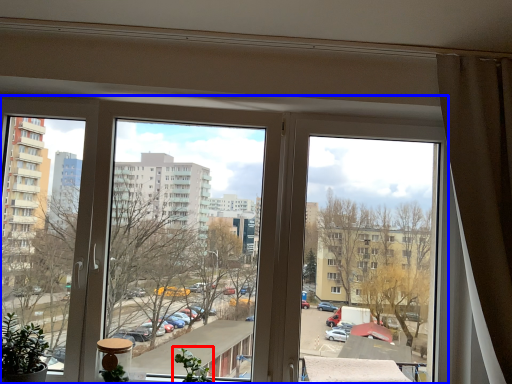
Question: Which point is further to the camera, plant (highlighted by a red box) or window (highlighted by a blue box)?

Choices:
 (A) plant
 (B) window

Answer: (B)